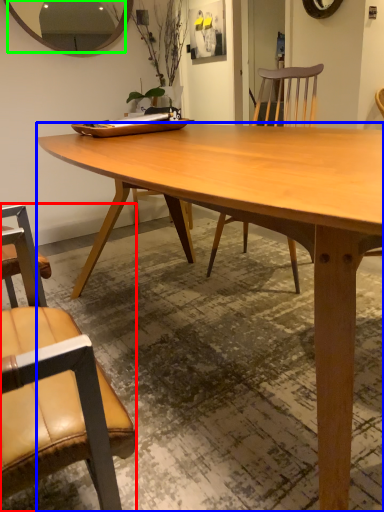
Question: Which object is positioned farthest from chair (highlighted by a red box)? Select from desk (highlighted by a blue box) and mirror (highlighted by a green box).

Choices:
 (A) desk
 (B) mirror

Answer: (B)